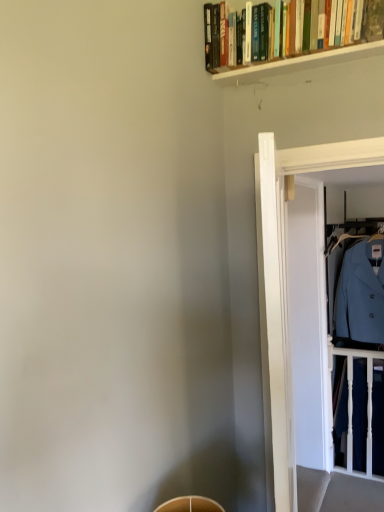
The image size is (384, 512). I want to click on transparent glass door at right, so click(x=286, y=288).

Where is `white wooden balustrade at right`? This screenshot has height=512, width=384. white wooden balustrade at right is located at coordinates (351, 396).

From the image's perspective, between light blue woolen coat at right and white wooden balustrade at right, which one is located above?

light blue woolen coat at right is shown above in the image.

From a real-world perspective, which is physically below, light blue woolen coat at right or white wooden balustrade at right?

white wooden balustrade at right, from a real-world perspective.

Is the position of light blue woolen coat at right less distant than that of white wooden balustrade at right?

Yes, light blue woolen coat at right is closer to the viewer.

Would you say transparent glass door at right is part of light blue woolen coat at right's contents?

Actually, transparent glass door at right is outside light blue woolen coat at right.

Which object is positioned more to the right, light blue woolen coat at right or transparent glass door at right?

From the viewer's perspective, light blue woolen coat at right appears more on the right side.

Does light blue woolen coat at right have a lesser height compared to transparent glass door at right?

Yes, light blue woolen coat at right is shorter than transparent glass door at right.

Would you consider light blue woolen coat at right to be distant from transparent glass door at right?

Yes, light blue woolen coat at right is far from transparent glass door at right.

Can you tell me how much white wooden balustrade at right and transparent glass door at right differ in facing direction?

They differ by 2.29 degrees in their facing directions.

Is white wooden balustrade at right at the left side of transparent glass door at right?

In fact, white wooden balustrade at right is to the right of transparent glass door at right.

From the image's perspective, is white wooden balustrade at right above or below transparent glass door at right?

From the image's perspective, white wooden balustrade at right appears below transparent glass door at right.

Considering the relative sizes of transparent glass door at right and white wooden balustrade at right in the image provided, is transparent glass door at right wider than white wooden balustrade at right?

Indeed, transparent glass door at right has a greater width compared to white wooden balustrade at right.

Is transparent glass door at right smaller than white wooden balustrade at right?

No, transparent glass door at right is not smaller than white wooden balustrade at right.

From the image's perspective, who appears lower, transparent glass door at right or white wooden balustrade at right?

white wooden balustrade at right appears lower in the image.

Between transparent glass door at right and light blue woolen coat at right, which one has smaller size?

With smaller size is transparent glass door at right.

From their relative heights in the image, would you say transparent glass door at right is taller or shorter than light blue woolen coat at right?

In the image, transparent glass door at right appears to be taller than light blue woolen coat at right.

Is transparent glass door at right to the left or to the right of light blue woolen coat at right in the image?

In the image, transparent glass door at right appears on the left side of light blue woolen coat at right.

How much distance is there between white wooden balustrade at right and light blue woolen coat at right?

14.99 inches.

From the image's perspective, which is above, white wooden balustrade at right or light blue woolen coat at right?

light blue woolen coat at right appears higher in the image.

Which of these two, white wooden balustrade at right or light blue woolen coat at right, stands shorter?

light blue woolen coat at right is shorter.

Does white wooden balustrade at right have a lesser width compared to light blue woolen coat at right?

Correct, the width of white wooden balustrade at right is less than that of light blue woolen coat at right.

Locate an element on the screen. dress shirt on the right of the white wooden balustrade at right is located at coordinates (361, 294).

The width and height of the screenshot is (384, 512). I want to click on glass door that appears below the light blue woolen coat at right (from the image's perspective), so click(x=286, y=288).

Based on their spatial positions, is white wooden balustrade at right or light blue woolen coat at right further from transparent glass door at right?

white wooden balustrade at right.

Looking at the image, which one is located closer to transparent glass door at right, light blue woolen coat at right or white wooden balustrade at right?

The object closer to transparent glass door at right is light blue woolen coat at right.

Looking at the image, which one is located further to white wooden balustrade at right, light blue woolen coat at right or transparent glass door at right?

transparent glass door at right lies further to white wooden balustrade at right than the other object.

Based on their spatial positions, is transparent glass door at right or light blue woolen coat at right closer to white wooden balustrade at right?

Among the two, light blue woolen coat at right is located nearer to white wooden balustrade at right.

Considering their positions, is white wooden balustrade at right positioned further to light blue woolen coat at right than transparent glass door at right?

Among the two, transparent glass door at right is located further to light blue woolen coat at right.

Looking at the image, which one is located further to light blue woolen coat at right, transparent glass door at right or white wooden balustrade at right?

transparent glass door at right is further to light blue woolen coat at right.

You are a GUI agent. You are given a task and a screenshot of the screen. Output one action in this format:
    pyautogui.click(x=<x>, y=<y>)
    Task: Click on the dress shirt located between transparent glass door at right and white wooden balustrade at right in the depth direction
    This screenshot has width=384, height=512.
    Given the screenshot: What is the action you would take?
    pyautogui.click(x=361, y=294)